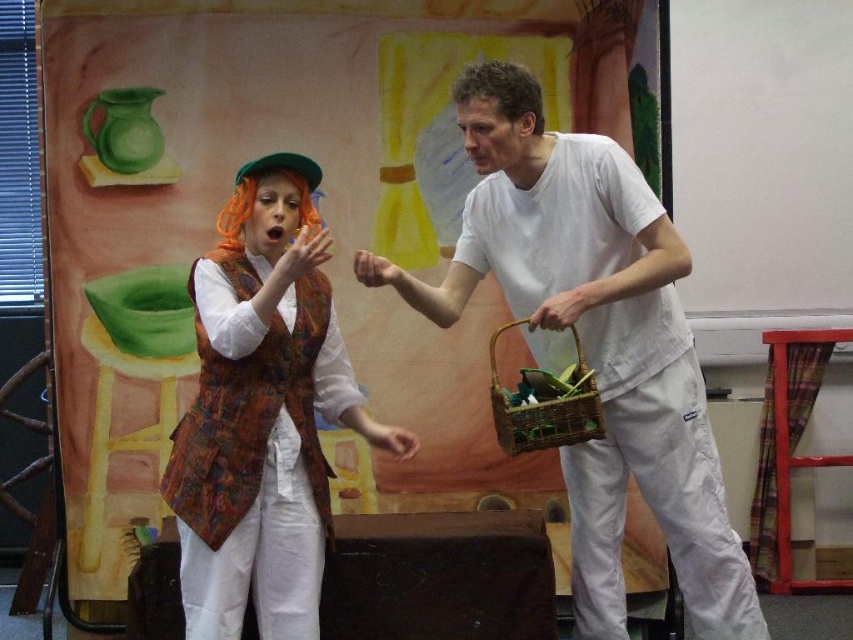
Who is higher up, white matte shirt at center or woven brown basket at right?

woven brown basket at right

Does white matte shirt at center appear on the right side of woven brown basket at right?

Indeed, white matte shirt at center is positioned on the right side of woven brown basket at right.

Who is more forward, (547, 262) or (582, 417)?

Positioned in front is point (582, 417).

Locate an element on the screen. white matte shirt at center is located at coordinates (595, 342).

In the scene shown: Between white matte shirt at center and printed fabric vest at center, which one has less height?

With less height is printed fabric vest at center.

Is point (659, 349) behind point (297, 305)?

Yes.

Identify the location of white matte shirt at center. (595, 342).

Can you confirm if printed fabric vest at center is smaller than woven brown basket at right?

Incorrect, printed fabric vest at center is not smaller in size than woven brown basket at right.

Locate an element on the screen. printed fabric vest at center is located at coordinates (256, 451).